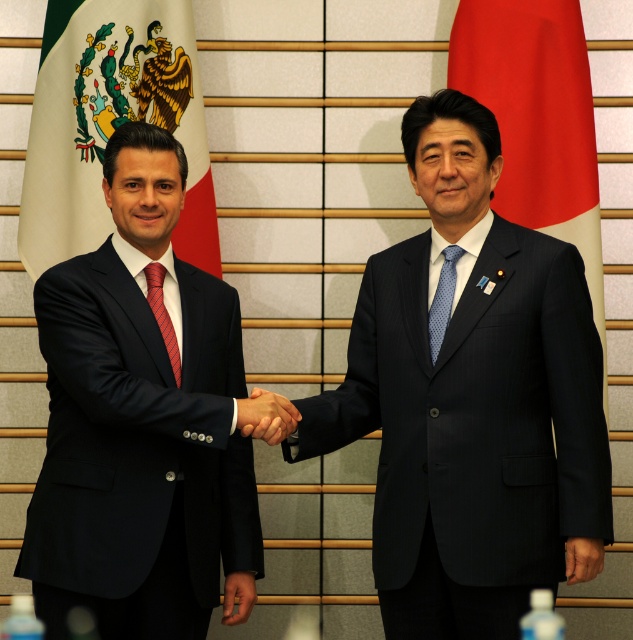
From the picture: Is white fabric flag at left shorter than red fabric flag at right?

Yes, white fabric flag at left is shorter than red fabric flag at right.

Which is in front, point (68, 58) or point (548, 225)?

Point (548, 225) is in front.

Locate an element on the screen. white fabric flag at left is located at coordinates (110, 124).

Who is higher up, matte black suit at left or white fabric flag at left?

white fabric flag at left

Can you confirm if matte black suit at left is positioned below white fabric flag at left?

Indeed, matte black suit at left is positioned under white fabric flag at left.

Find the location of `matte black suit at left`. matte black suit at left is located at coordinates (141, 424).

Between point (546, 140) and point (268, 416), which one is positioned behind?

The point (546, 140) is more distant.

Is point (573, 188) closer to viewer compared to point (261, 438)?

No, (573, 188) is further to viewer.

Does point (539, 1) come behind point (289, 417)?

Yes, it is.

You are a GUI agent. You are given a task and a screenshot of the screen. Output one action in this format:
    pyautogui.click(x=<x>, y=<y>)
    Task: Click on the red fabric flag at right
    Image resolution: width=633 pixels, height=640 pixels.
    Given the screenshot: What is the action you would take?
    pyautogui.click(x=536, y=116)